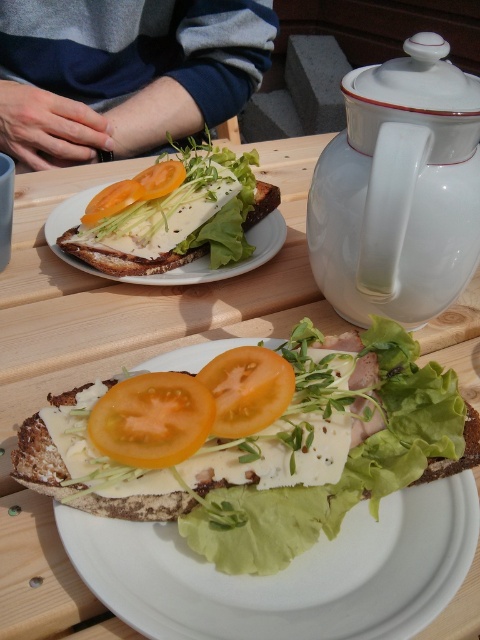
Question: Which is farther from the white ceramic teapot at upper right?

Choices:
 (A) white ceramic plate at upper center
 (B) white creamy cheese at center
 (C) juicy orange tomato at center

Answer: (C)

Question: Which point is closer to the camera?

Choices:
 (A) orange matte tomato at center
 (B) juicy orange tomato at center

Answer: (B)

Question: Is orange matte tomato at center positioned before orange matte tomato at upper center?

Choices:
 (A) yes
 (B) no

Answer: (A)

Question: Is white cheese sandwich at center closer to camera compared to yellow juicy tomato at center?

Choices:
 (A) no
 (B) yes

Answer: (B)

Question: Which object is positioned farthest from the orange matte tomato at upper center?

Choices:
 (A) juicy orange tomato at center
 (B) white creamy cheese at center
 (C) white ceramic plate at upper center

Answer: (B)

Question: Does white creamy cheese at center lie behind white ceramic plate at upper center?

Choices:
 (A) no
 (B) yes

Answer: (A)